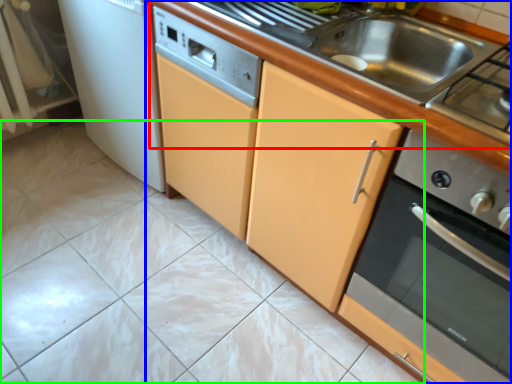
Question: Which is nearer to the counter top (highlighted by a red box)? countertop (highlighted by a blue box) or ceramic tile (highlighted by a green box).

Choices:
 (A) countertop
 (B) ceramic tile

Answer: (A)